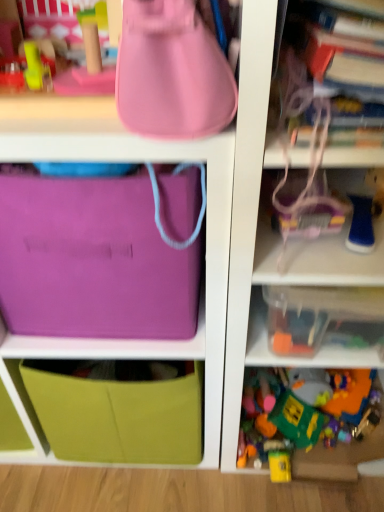
Where is `free space that is to the left of matte pink handbag at upper center`? The width and height of the screenshot is (384, 512). free space that is to the left of matte pink handbag at upper center is located at coordinates (69, 114).